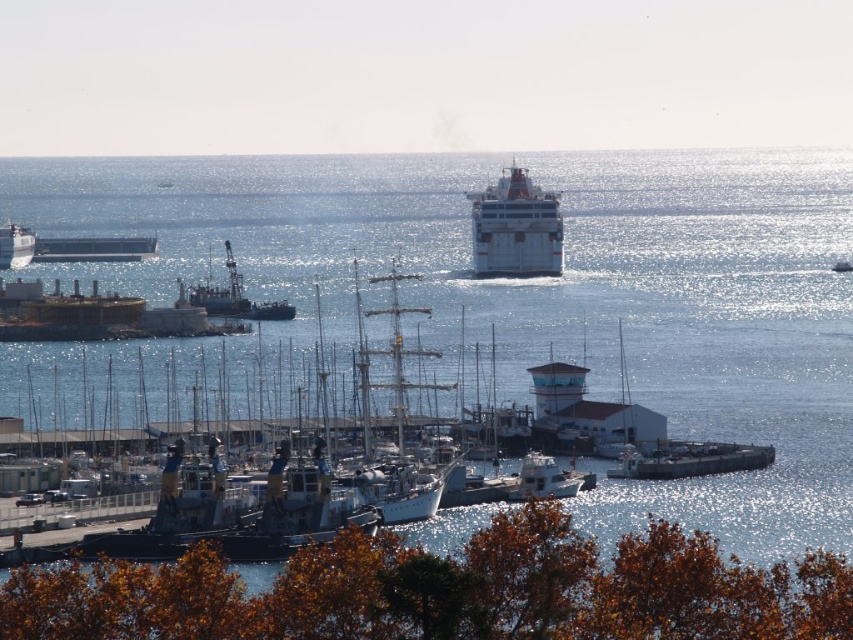
Consider the image. You are a crane operator at the harbor and need to load cargo onto the metallic gray barge at center located at point (x=689, y=460). The crane is positioned at point 0.5, 0.5. Can you reach the barge with your crane? The crane has a maximum reach of 0.3 units in any direction from its position.

The metallic gray barge at center is located at point (x=689, y=460). The crane is at 0.5, 0.5. The distance between them is sqrt? 0.719?0.5 squared plus 0.810?0.5 squared. Let me calculate that. The difference in x is 0.219, squared is 0.048. The difference in y is 0.31, squared is 0.096. Total squared distance is 0.144, so square root is approximately 0.38. Since the crane can only reach 0.3 units, it cannot reach the barge.